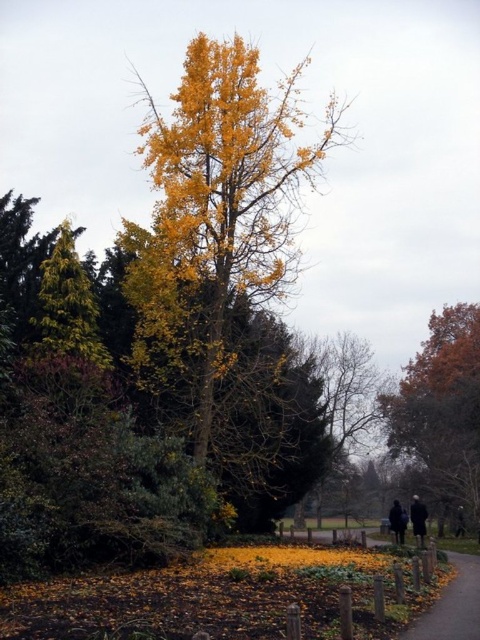
Question: Which of the following is the closest to the observer?

Choices:
 (A) (441, 365)
 (B) (468, 609)
 (C) (392, 531)
 (D) (456, 518)

Answer: (B)

Question: Which point appears closest to the camera in this image?

Choices:
 (A) (456, 529)
 (B) (462, 380)

Answer: (A)

Question: In this image, where is dark blue fabric jacket at lower right located relative to black fabric person at center?

Choices:
 (A) left
 (B) right

Answer: (A)

Question: Is the position of paved asphalt path at lower center more distant than that of black fabric person at center?

Choices:
 (A) yes
 (B) no

Answer: (B)

Question: Which point is closer to the camera taking this photo?

Choices:
 (A) (471, 572)
 (B) (397, 524)
 (C) (420, 522)

Answer: (A)

Question: From the image, what is the correct spatial relationship of paved asphalt path at lower center in relation to dark gray jacket at lower right?

Choices:
 (A) above
 (B) below

Answer: (A)